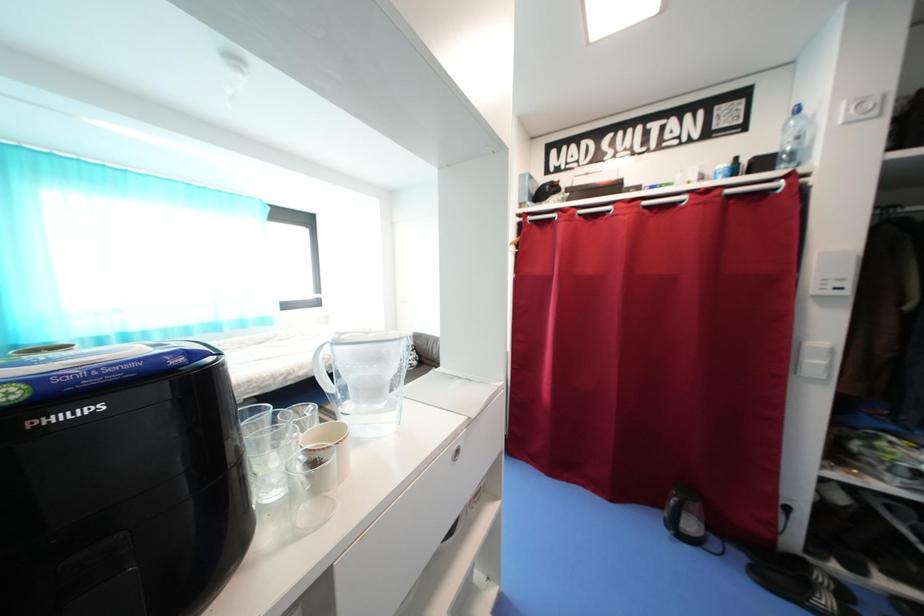
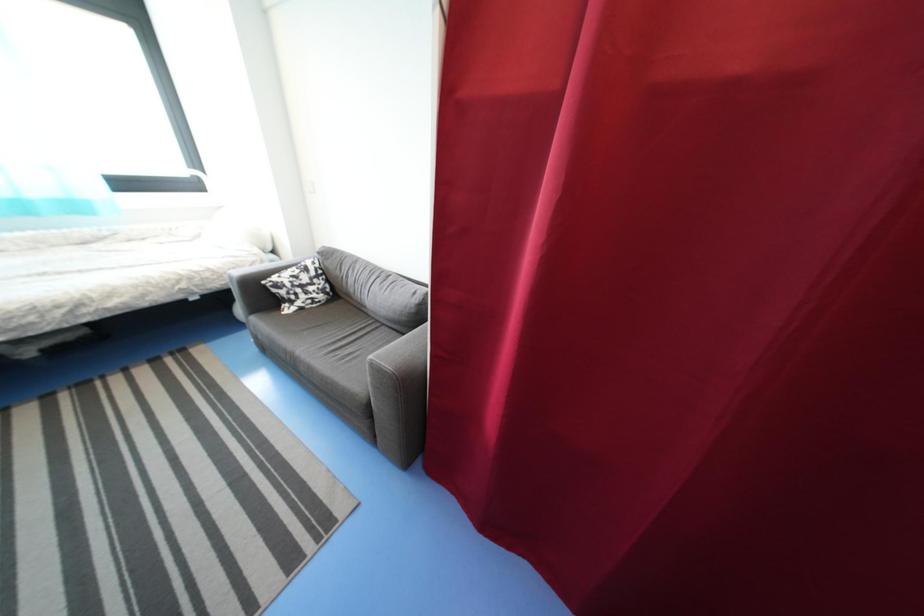
Which direction would the cameraman need to move to produce the second image?

The cameraman walked toward right, forward.